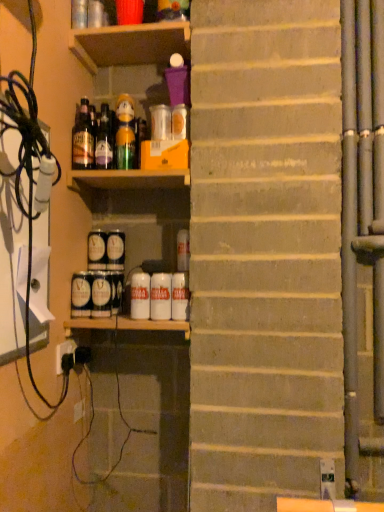
Question: From the image's perspective, would you say white matte can at center, the 6th beverage in the left-to-right sequence, is positioned over matte black can at center, which ranks as the 8th beverage in right-to-left order?

Choices:
 (A) no
 (B) yes

Answer: (A)

Question: Is white matte can at center, the 6th beverage in the left-to-right sequence, aimed at matte black can at center, which ranks as the 8th beverage in right-to-left order?

Choices:
 (A) no
 (B) yes

Answer: (A)

Question: Can you confirm if white matte can at center, marked as the 3th beverage in a right-to-left arrangement, is smaller than matte black can at center, the first beverage in the left-to-right sequence?

Choices:
 (A) yes
 (B) no

Answer: (A)

Question: Is white matte can at center, the 6th beverage in the left-to-right sequence, looking in the opposite direction of matte black can at center, which ranks as the 8th beverage in right-to-left order?

Choices:
 (A) no
 (B) yes

Answer: (A)

Question: Is white matte can at center, marked as the 3th beverage in a right-to-left arrangement, outside of matte black can at center, which ranks as the 8th beverage in right-to-left order?

Choices:
 (A) yes
 (B) no

Answer: (A)

Question: From the image's perspective, is translucent glass bottle at upper left, which is the 2th bottle in left-to-right order, positioned above or below wooden shelf at upper center?

Choices:
 (A) above
 (B) below

Answer: (B)

Question: In terms of size, does translucent glass bottle at upper left, marked as the second bottle in a right-to-left arrangement, appear bigger or smaller than wooden shelf at upper center?

Choices:
 (A) big
 (B) small

Answer: (B)

Question: Visually, is translucent glass bottle at upper left, marked as the second bottle in a right-to-left arrangement, positioned to the left or to the right of wooden shelf at upper center?

Choices:
 (A) left
 (B) right

Answer: (A)

Question: Is translucent glass bottle at upper left, which is the 2th bottle in left-to-right order, wider or thinner than wooden shelf at upper center?

Choices:
 (A) thin
 (B) wide

Answer: (A)

Question: In terms of size, does white matte can at center, which is the 1th beverage in right-to-left order, appear bigger or smaller than matte black can at center, the first beverage in the left-to-right sequence?

Choices:
 (A) big
 (B) small

Answer: (B)

Question: From a real-world perspective, is white matte can at center, which is counted as the eighth beverage, starting from the left, physically located above or below matte black can at center, the first beverage in the left-to-right sequence?

Choices:
 (A) above
 (B) below

Answer: (B)

Question: Considering their positions, is white matte can at center, which is the 1th beverage in right-to-left order, located in front of or behind matte black can at center, the first beverage in the left-to-right sequence?

Choices:
 (A) front
 (B) behind

Answer: (A)

Question: Is white matte can at center, which is the 1th beverage in right-to-left order, wider or thinner than matte black can at center, which ranks as the 8th beverage in right-to-left order?

Choices:
 (A) thin
 (B) wide

Answer: (A)

Question: Visually, is blue matte can at lower center, which is counted as the third beverage, starting from the left, positioned to the left or to the right of white matte can at center, the fourth beverage when ordered from right to left?

Choices:
 (A) left
 (B) right

Answer: (A)

Question: In terms of width, does blue matte can at lower center, which is counted as the third beverage, starting from the left, look wider or thinner when compared to white matte can at center, which ranks as the 5th beverage in left-to-right order?

Choices:
 (A) wide
 (B) thin

Answer: (A)